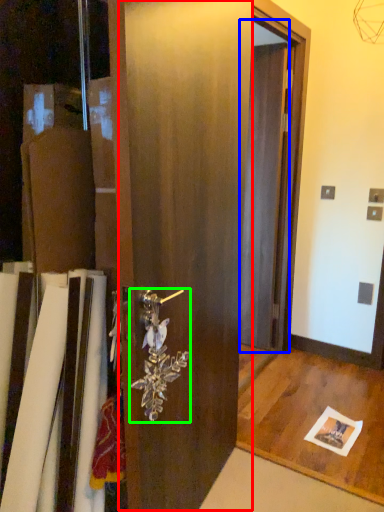
Question: Which object is positioned farthest from barn door (highlighted by a red box)? Select from screen door (highlighted by a blue box) and door handle (highlighted by a green box).

Choices:
 (A) screen door
 (B) door handle

Answer: (A)